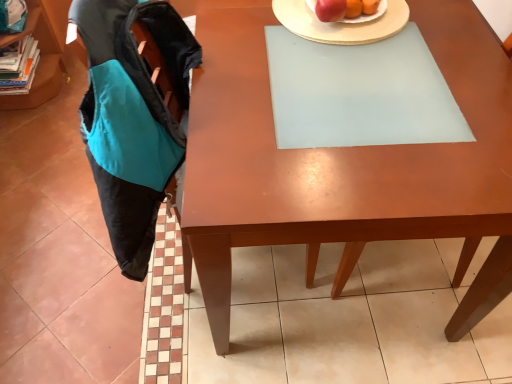
You are a GUI agent. You are given a task and a screenshot of the screen. Output one action in this format:
    pyautogui.click(x=<x>, y=<y>)
    Task: Click on the empty space that is ontop of white ceramic plate at upper center
    The image size is (512, 384).
    Given the screenshot: What is the action you would take?
    pyautogui.click(x=348, y=16)